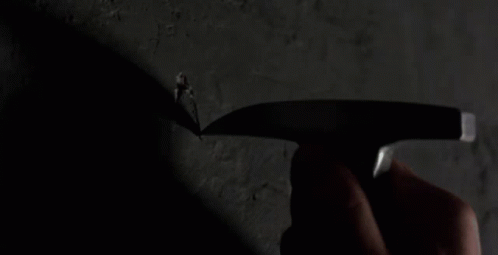
Where is `letter being carved into wall`? This screenshot has width=498, height=255. letter being carved into wall is located at coordinates [x=173, y=94].